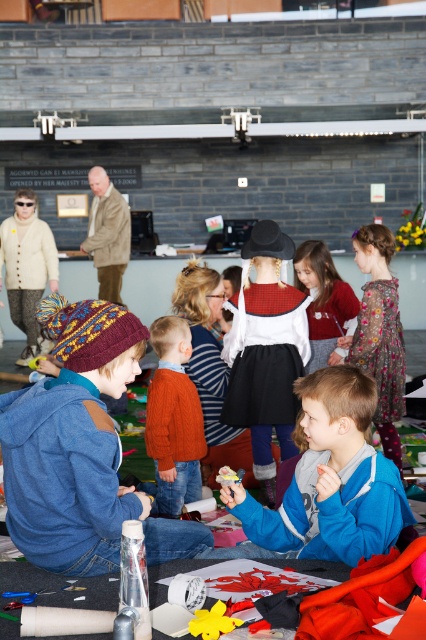
Can you confirm if blue fleece jacket at center is wider than velvet red sweater at center?

Yes, blue fleece jacket at center is wider than velvet red sweater at center.

Is blue fleece jacket at center to the left of velvet red sweater at center from the viewer's perspective?

Indeed, blue fleece jacket at center is positioned on the left side of velvet red sweater at center.

Is point (287, 528) positioned before point (325, 298)?

Yes, it is in front of point (325, 298).

The image size is (426, 640). Find the location of `blue fleece jacket at center`. blue fleece jacket at center is located at coordinates (331, 477).

Does knitted woolen hat at lower left lie in front of velvet red sweater at center?

Yes.

Can you confirm if knitted woolen hat at lower left is positioned to the right of velvet red sweater at center?

No, knitted woolen hat at lower left is not to the right of velvet red sweater at center.

What are the coordinates of `knitted woolen hat at lower left` in the screenshot? It's located at (80, 449).

Locate an element on the screen. knitted woolen hat at lower left is located at coordinates (80, 449).

Who is positioned more to the left, knitted woolen hat at lower left or blue fleece jacket at center?

Positioned to the left is knitted woolen hat at lower left.

The image size is (426, 640). What do you see at coordinates (80, 449) in the screenshot?
I see `knitted woolen hat at lower left` at bounding box center [80, 449].

Is point (52, 477) positioned in front of point (339, 381)?

That is True.

What are the coordinates of `knitted woolen hat at lower left` in the screenshot? It's located at (80, 449).